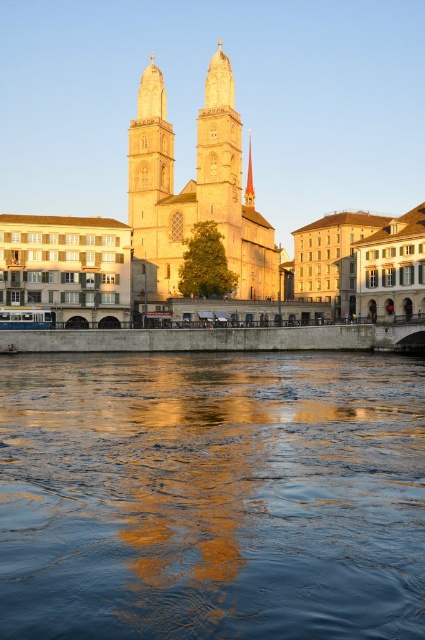
Which is more to the right, golden stone tower at center or gold polished spire at center?

gold polished spire at center

Is the position of golden stone tower at center more distant than that of gold polished spire at center?

That is False.

Between point (252, 209) and point (244, 188), which one is positioned behind?

Positioned behind is point (252, 209).

Where is `golden stone tower at center`? golden stone tower at center is located at coordinates (195, 189).

In the scene shown: Between blue reflective water at center and golden stone tower at center, which one has more height?

With more height is golden stone tower at center.

Consider the image. Between blue reflective water at center and golden stone tower at center, which one is positioned higher?

golden stone tower at center

Which is in front, point (44, 605) or point (274, 259)?

Positioned in front is point (44, 605).

At what (x,y) coordinates should I click in order to perform the action: click on blue reflective water at center. Please return your answer as a coordinate pair (x, y). Looking at the image, I should click on (212, 497).

Is blue reflective water at center below gold polished spire at center?

Yes.

Which is above, blue reflective water at center or gold polished spire at center?

gold polished spire at center is higher up.

Who is more forward, (397, 484) or (249, 195)?

Positioned in front is point (397, 484).

Locate an element on the screen. This screenshot has width=425, height=640. blue reflective water at center is located at coordinates (212, 497).